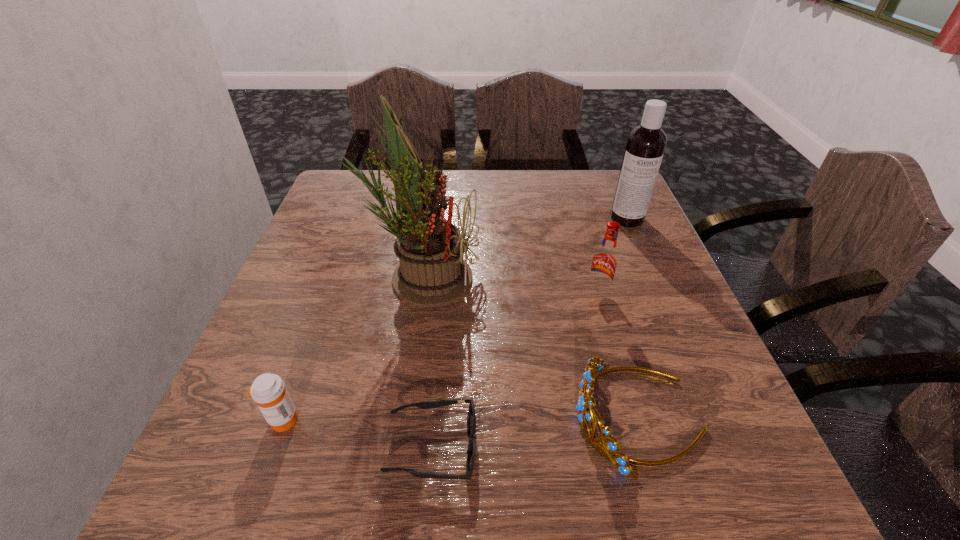
Identify the location of vacant space situated 0.190m on the left of the fourth shortest object. The image size is (960, 540). (496, 292).

At what (x,y) coordinates should I click in order to perform the action: click on vacant region located on the front-facing side of the third shortest object. Please return your answer as a coordinate pair (x, y). Image resolution: width=960 pixels, height=540 pixels. Looking at the image, I should click on (353, 417).

What are the coordinates of `free space located 0.160m on the front-facing side of the third shortest object` in the screenshot? It's located at (476, 417).

Image resolution: width=960 pixels, height=540 pixels. Identify the location of free location located 0.140m on the front-facing side of the third shortest object. (489, 417).

The image size is (960, 540). Find the location of `vacant region located on the back of the fifth tallest object`. vacant region located on the back of the fifth tallest object is located at coordinates (327, 297).

Identify the location of vacant space situated 0.330m on the front-facing side of the shortest object. Image resolution: width=960 pixels, height=540 pixels. (691, 447).

Identify the location of object present at the far edge. (646, 143).

Locate an element on the screen. tiara at the near edge is located at coordinates (610, 449).

This screenshot has height=540, width=960. I want to click on sunglasses situated at the near edge, so click(471, 417).

Where is `object at the left edge`? Image resolution: width=960 pixels, height=540 pixels. object at the left edge is located at coordinates (268, 390).